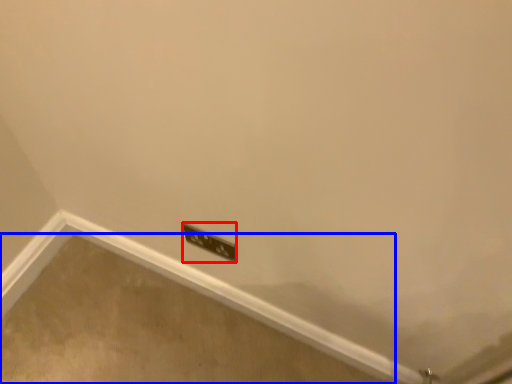
Question: Which point is closer to the camera, power plugs and sockets (highlighted by a red box) or concrete (highlighted by a blue box)?

Choices:
 (A) power plugs and sockets
 (B) concrete

Answer: (A)